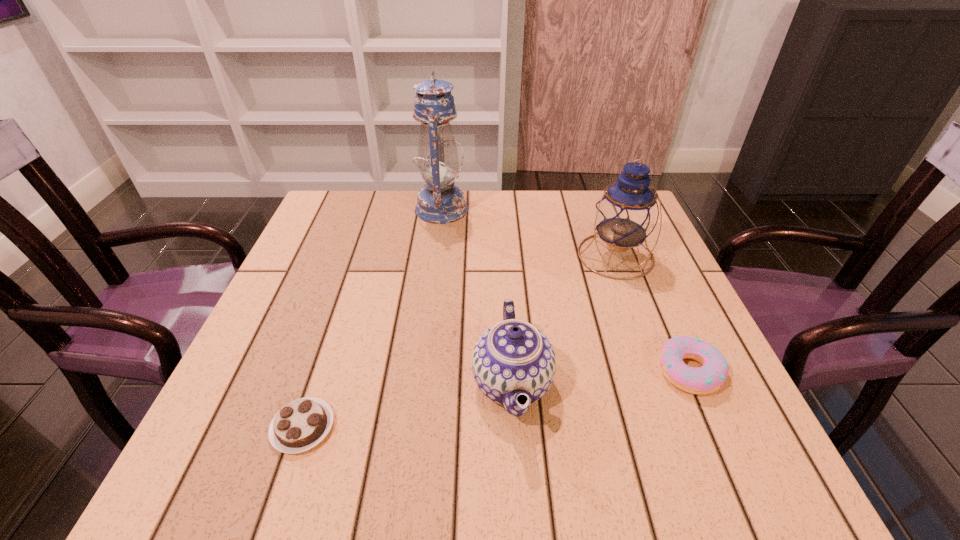
The image size is (960, 540). I want to click on doughnut at the right edge, so click(x=707, y=379).

What are the coordinates of `object present at the near left corner` in the screenshot? It's located at (300, 425).

The height and width of the screenshot is (540, 960). Identify the location of object that is at the far right corner. (626, 214).

Image resolution: width=960 pixels, height=540 pixels. In order to click on vacant space at the far edge of the desktop in this screenshot , I will do `click(384, 207)`.

In the image, there is a desktop. Identify the location of vacant space at the near edge. The height and width of the screenshot is (540, 960). (611, 465).

Locate an element on the screen. The height and width of the screenshot is (540, 960). vacant space at the left edge of the desktop is located at coordinates (320, 347).

Identify the location of vacant space at the right edge of the desktop. (672, 273).

Find the location of a particular element. Image resolution: width=960 pixels, height=540 pixels. vacant area at the far left corner is located at coordinates (374, 215).

Locate an element on the screen. The image size is (960, 540). vacant space at the near left corner is located at coordinates (270, 475).

Identify the location of vacant point at the far right corner. This screenshot has height=540, width=960. (597, 190).